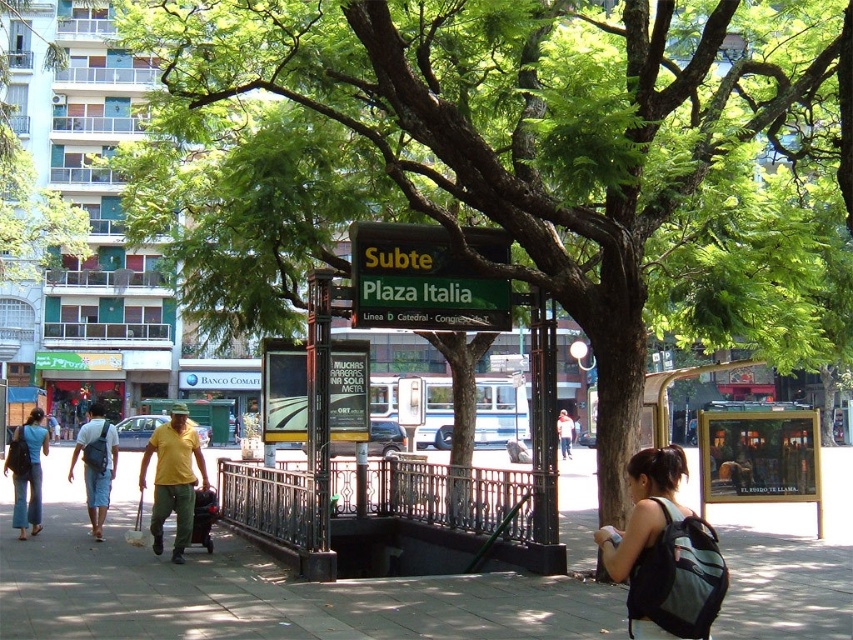
Question: Does yellow matte shirt at center have a larger size compared to light blue denim shorts at lower left?

Choices:
 (A) yes
 (B) no

Answer: (B)

Question: Which of the following is the farthest from the observer?

Choices:
 (A) (445, 282)
 (B) (189, 621)
 (C) (22, 477)
 (D) (672, 456)

Answer: (C)

Question: Can you confirm if green matte sign at center is wider than light blue denim shorts at lower left?

Choices:
 (A) no
 (B) yes

Answer: (A)

Question: Can you confirm if yellow matte shirt at center is positioned to the left of light blue denim shorts at lower left?

Choices:
 (A) yes
 (B) no

Answer: (B)

Question: Which point is farther from the camera taking this photo?

Choices:
 (A) (590, 506)
 (B) (91, 474)
 (C) (172, 417)
 (D) (561, 442)

Answer: (D)

Question: Which of these objects is positioned closest to the gray concrete pavement at center?

Choices:
 (A) denim pants at lower left
 (B) light blue denim shorts at lower left
 (C) light blue jeans at center

Answer: (C)